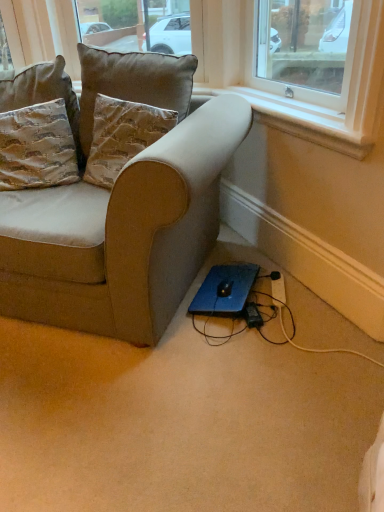
You are a GUI agent. You are given a task and a screenshot of the screen. Output one action in this format:
    pyautogui.click(x=<x>, y=<y>)
    Task: Click on the free space above white plastic window sill at upper right (from a real-world perspective)
    The image size is (384, 512).
    Given the screenshot: What is the action you would take?
    pyautogui.click(x=290, y=103)